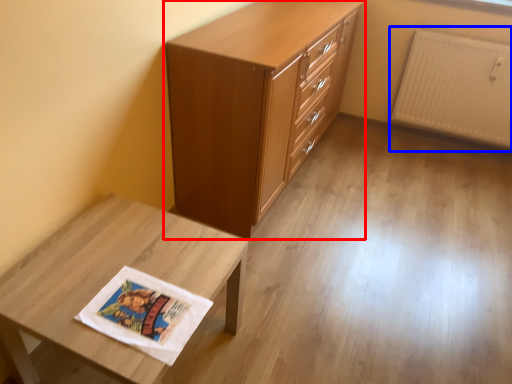
Question: Which object appears farthest to the camera in this image, chest of drawers (highlighted by a red box) or radiator (highlighted by a blue box)?

Choices:
 (A) chest of drawers
 (B) radiator

Answer: (B)